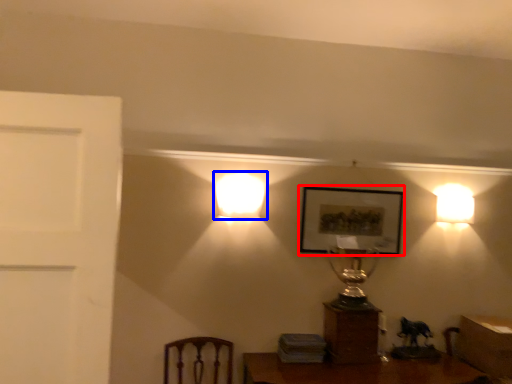
Question: Which object is closer to the camera taking this photo, picture frame (highlighted by a red box) or lamp (highlighted by a blue box)?

Choices:
 (A) picture frame
 (B) lamp

Answer: (B)